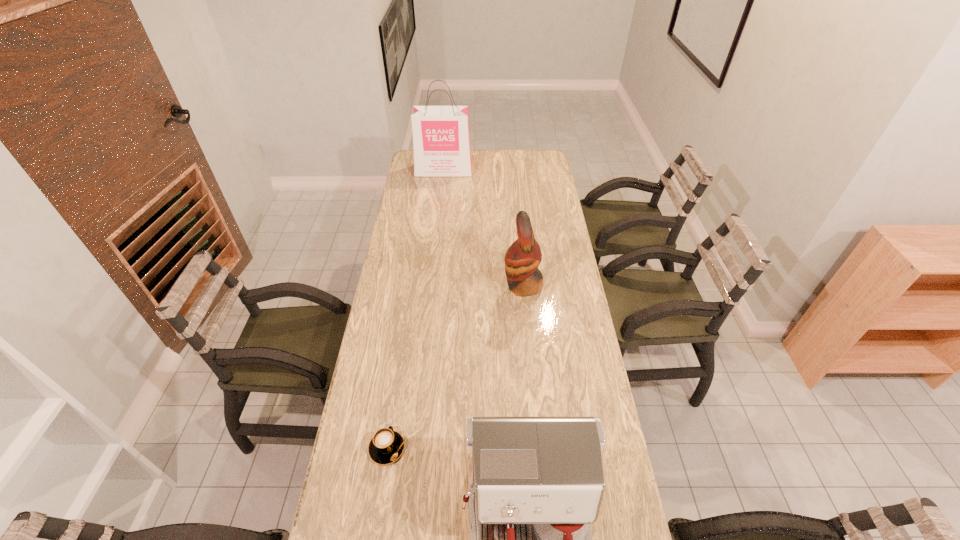
Identify which object is the second nearest to the shortest object. Please provide its 2D coordinates. Your answer should be formatted as a tuple, i.e. [(x, y)], where the tuple contains the x and y coordinates of a point satisfying the conditions above.

[(523, 257)]

The image size is (960, 540). In order to click on object that stands as the closest to the third nearest object in this screenshot , I will do `click(387, 445)`.